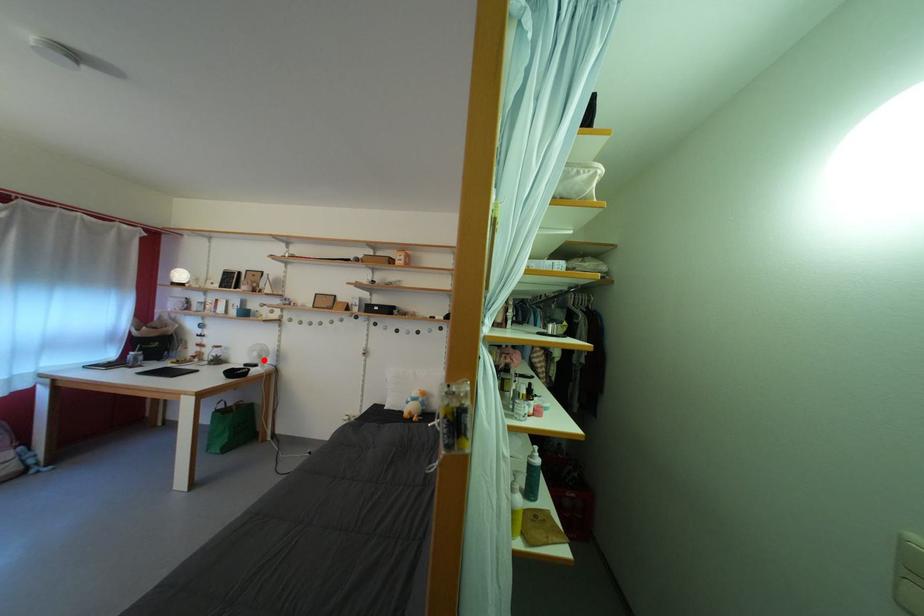
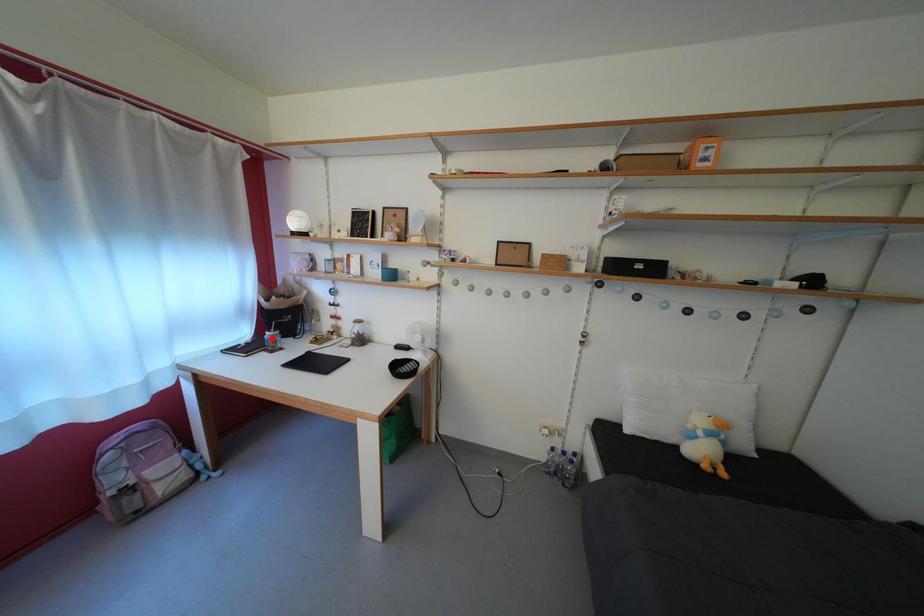
I am providing you with two images of the same scene from different viewpoints. A red point is marked on the first image and another point is marked on the second image. Does the point marked in image1 correspond to the same location as the one in image2?

No